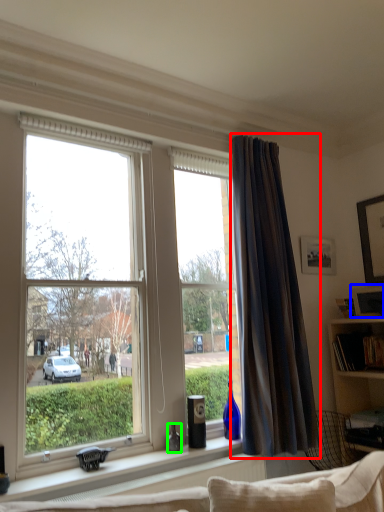
Question: Which object is the farthest from curtain (highlighted by a red box)? Choose among these: picture frame (highlighted by a blue box) or bottle (highlighted by a green box).

Choices:
 (A) picture frame
 (B) bottle

Answer: (B)